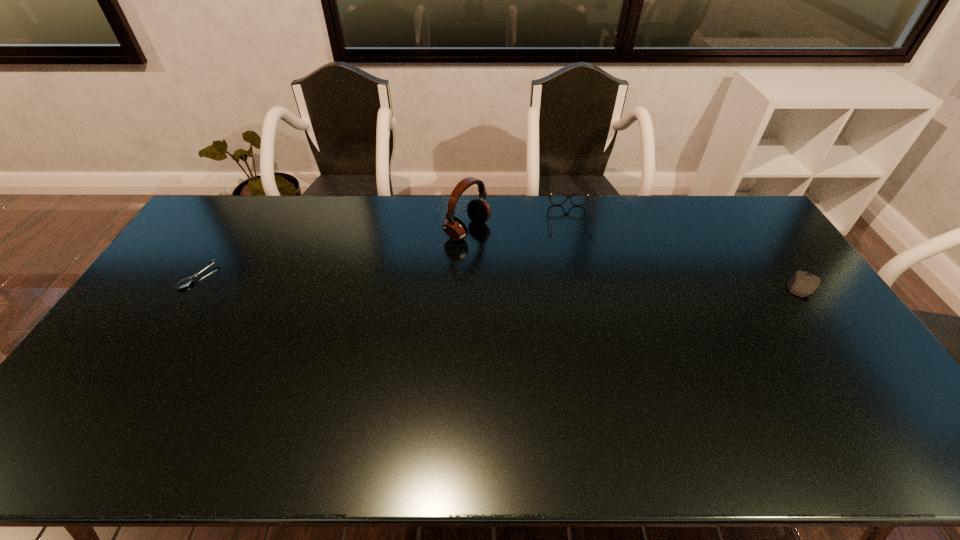
What are the coordinates of `blank area in the image that satisfies the following two spatial constraints: 1. on the back side of the spectacles; 2. on the left side of the headset` in the screenshot? It's located at (468, 220).